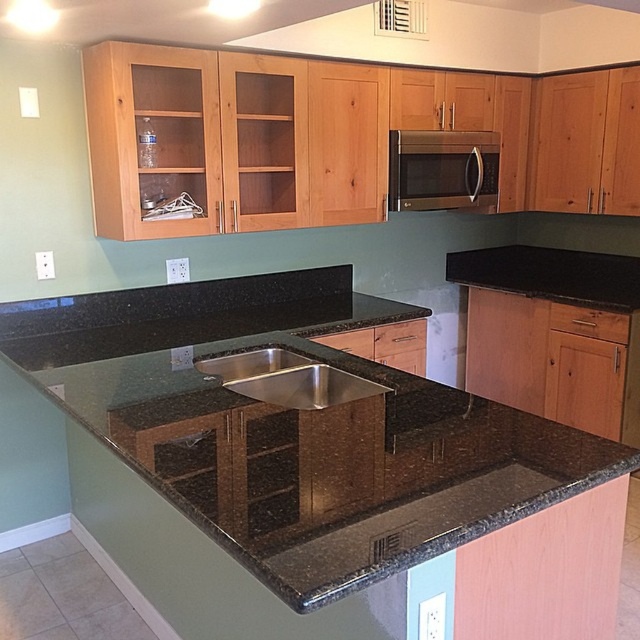
You are a delivery person who just arrived at the kitchen to install a new microwave. The current microwave is located at point (442, 170). Can you confirm the exact location of the existing microwave in the kitchen?

The satin stainless steel microwave at upper center is located at point (442, 170).

Looking at this image, you are a chef preparing to place a large pot on the black granite countertop at center. The pot has a diameter of 12 inches. Can you fit the pot on the countertop without it overlapping the stainless steel sink at center?

The distance between the black granite countertop at center and the stainless steel sink at center is 11.63 inches. Since the pot has a diameter of 12 inches, it would overlap the sink by approximately 0.37 inches. Therefore, the pot cannot be placed without overlapping the sink.

What are the coordinates of the black granite countertop at center?

The coordinates of the black granite countertop at center are at point (296, 428).